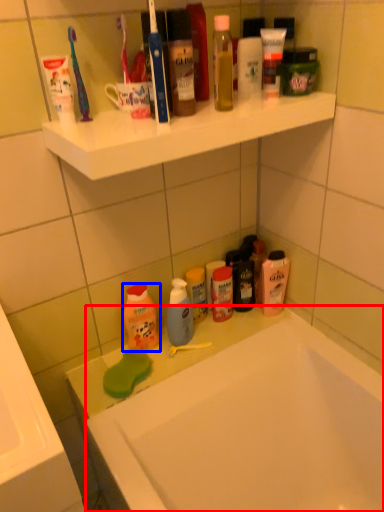
Question: Which object is closer to the camera taking this photo, bathtub (highlighted by a red box) or cleaning product (highlighted by a blue box)?

Choices:
 (A) bathtub
 (B) cleaning product

Answer: (A)